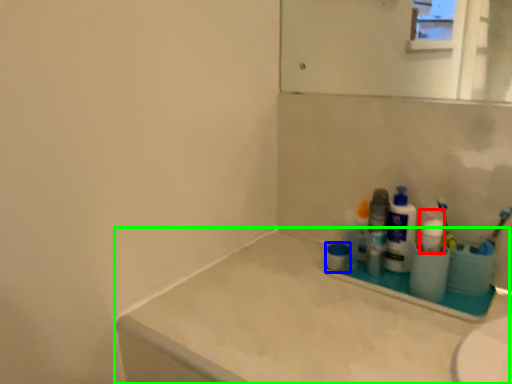
Question: Which is farther away from cleaning product (highlighted by a red box)? mouthwash (highlighted by a blue box) or counter top (highlighted by a green box)?

Choices:
 (A) mouthwash
 (B) counter top

Answer: (B)